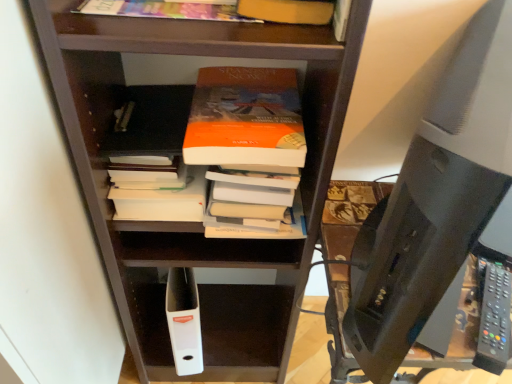
Question: Are brown wooden shelf at center and black plastic remote at lower right beside each other?

Choices:
 (A) yes
 (B) no

Answer: (B)

Question: From a real-world perspective, does brown wooden shelf at center stand above black plastic remote at lower right?

Choices:
 (A) yes
 (B) no

Answer: (B)

Question: Is brown wooden shelf at center bigger than black plastic remote at lower right?

Choices:
 (A) no
 (B) yes

Answer: (B)

Question: From the image's perspective, would you say brown wooden shelf at center is positioned over black plastic remote at lower right?

Choices:
 (A) no
 (B) yes

Answer: (B)

Question: Does brown wooden shelf at center have a lesser width compared to black plastic remote at lower right?

Choices:
 (A) yes
 (B) no

Answer: (B)

Question: Does brown wooden shelf at center have a greater height compared to black plastic remote at lower right?

Choices:
 (A) no
 (B) yes

Answer: (B)

Question: Would you say brown wooden shelf at center contains black plastic desktop computer at right?

Choices:
 (A) no
 (B) yes

Answer: (A)

Question: Is brown wooden shelf at center outside of black plastic desktop computer at right?

Choices:
 (A) yes
 (B) no

Answer: (A)

Question: Considering the relative sizes of brown wooden shelf at center and black plastic desktop computer at right in the image provided, is brown wooden shelf at center bigger than black plastic desktop computer at right?

Choices:
 (A) no
 (B) yes

Answer: (B)

Question: Can you confirm if brown wooden shelf at center is taller than black plastic desktop computer at right?

Choices:
 (A) yes
 (B) no

Answer: (A)

Question: Is the position of brown wooden shelf at center less distant than that of black plastic desktop computer at right?

Choices:
 (A) no
 (B) yes

Answer: (A)

Question: Can you confirm if brown wooden shelf at center is wider than black plastic desktop computer at right?

Choices:
 (A) no
 (B) yes

Answer: (B)

Question: From the image's perspective, would you say brown wooden shelf at center is positioned over white matte book at center, which is the first book in back-to-front order?

Choices:
 (A) no
 (B) yes

Answer: (A)